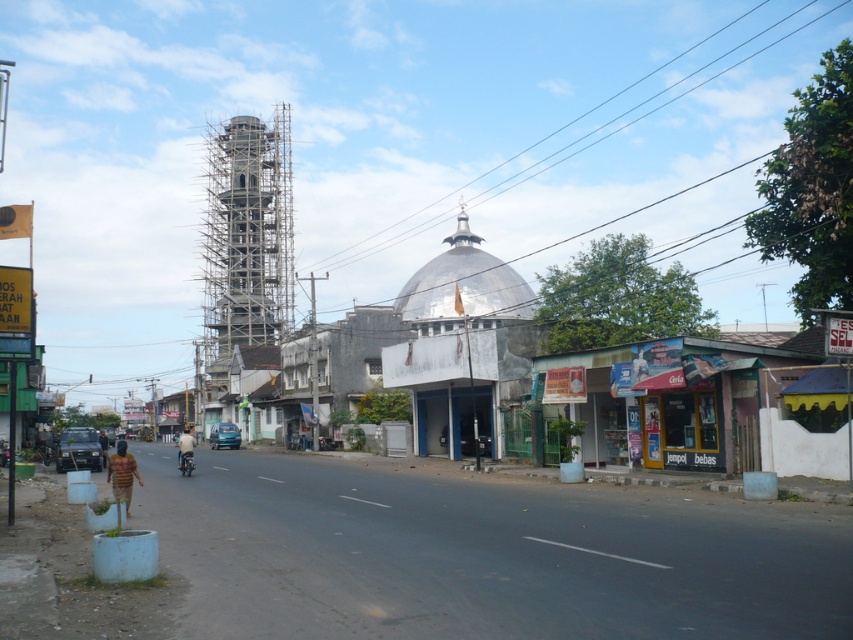
Who is lower down, scaffolding/wooden structure at center-left or white marble dome at center?

Positioned lower is white marble dome at center.

Does scaffolding/wooden structure at center-left have a greater height compared to white marble dome at center?

Yes, scaffolding/wooden structure at center-left is taller than white marble dome at center.

The height and width of the screenshot is (640, 853). What do you see at coordinates (245, 241) in the screenshot? I see `scaffolding/wooden structure at center-left` at bounding box center [245, 241].

This screenshot has height=640, width=853. Find the location of `scaffolding/wooden structure at center-left`. scaffolding/wooden structure at center-left is located at coordinates (245, 241).

Can you confirm if scaffolding/wooden structure at center-left is positioned above shiny metallic motorcycle at center?

Indeed, scaffolding/wooden structure at center-left is positioned over shiny metallic motorcycle at center.

Which is in front, point (289, 292) or point (181, 460)?

Positioned in front is point (181, 460).

You are a GUI agent. You are given a task and a screenshot of the screen. Output one action in this format:
    pyautogui.click(x=<x>, y=<y>)
    Task: Click on the scaffolding/wooden structure at center-left
    The image size is (853, 640).
    Given the screenshot: What is the action you would take?
    [245, 241]

I want to click on scaffolding/wooden structure at center-left, so tap(245, 241).

Consider the image. Is white marble dome at center below shiny metallic motorcycle at center?

No, white marble dome at center is not below shiny metallic motorcycle at center.

Can you confirm if white marble dome at center is shorter than shiny metallic motorcycle at center?

No, white marble dome at center is not shorter than shiny metallic motorcycle at center.

Does point (437, 289) come in front of point (187, 458)?

That is False.

This screenshot has height=640, width=853. What are the coordinates of `white marble dome at center` in the screenshot? It's located at (463, 282).